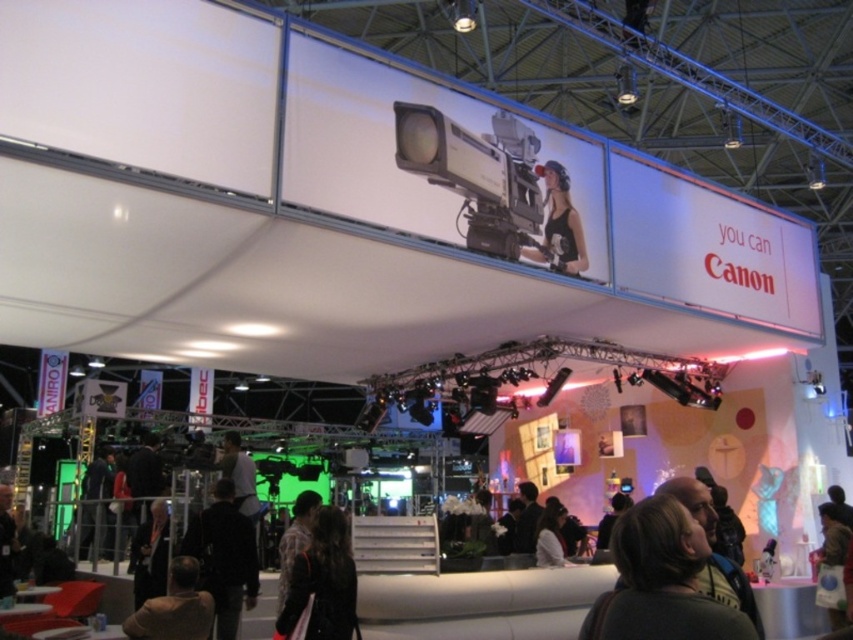
In order to click on dark brown hair at center in this screenshot , I will do `click(660, 580)`.

Which is more to the left, dark brown hair at center or brown leather jacket at lower left?

brown leather jacket at lower left

Where is `dark brown hair at center`? This screenshot has height=640, width=853. dark brown hair at center is located at coordinates (660, 580).

Locate an element on the screen. dark brown hair at center is located at coordinates (660, 580).

Between point (318, 516) and point (160, 602), which one is positioned in front?

Point (318, 516) is in front.

This screenshot has height=640, width=853. I want to click on dark brown leather jacket at lower center, so click(x=323, y=580).

Is dark brown hair at center to the left of matte black camera at upper center from the viewer's perspective?

Yes, dark brown hair at center is to the left of matte black camera at upper center.

Can you confirm if dark brown hair at center is thinner than matte black camera at upper center?

Yes, dark brown hair at center is thinner than matte black camera at upper center.

Describe the element at coordinates (660, 580) in the screenshot. This screenshot has height=640, width=853. I see `dark brown hair at center` at that location.

Where is `dark brown hair at center`? dark brown hair at center is located at coordinates (660, 580).